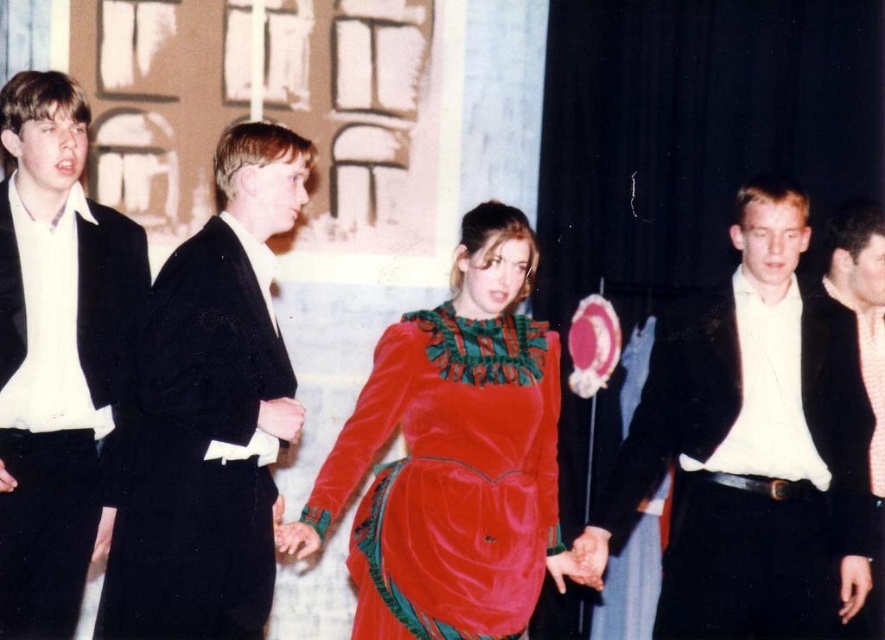
You are an audience member sitting in the front row of the theater. You see the shiny black suit at right and the velvet dress at center. Which one is positioned to the right side of the stage?

The shiny black suit at right is positioned to the right of the velvet dress at center, so the shiny black suit at right is on the right side of the stage.

You are an actor positioned at the center of the stage. You notice two points marked in the scene. The first point is at coordinate point (829, 372) and the second is at point (864, 273). Which point is closer to your current position?

Point (829, 372) is in front of point (864, 273), so it is closer to your current position at the center of the stage.